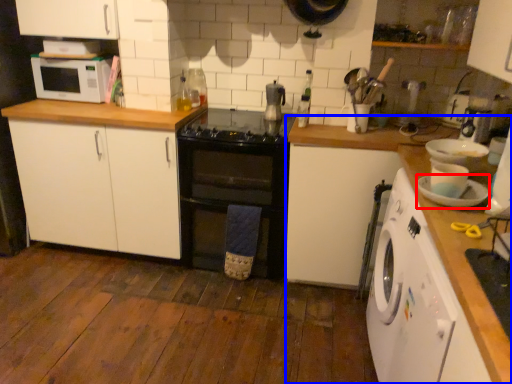
Question: Among these objects, which one is nearest to the camera, appliance (highlighted by a red box) or countertop (highlighted by a blue box)?

Choices:
 (A) appliance
 (B) countertop

Answer: (A)